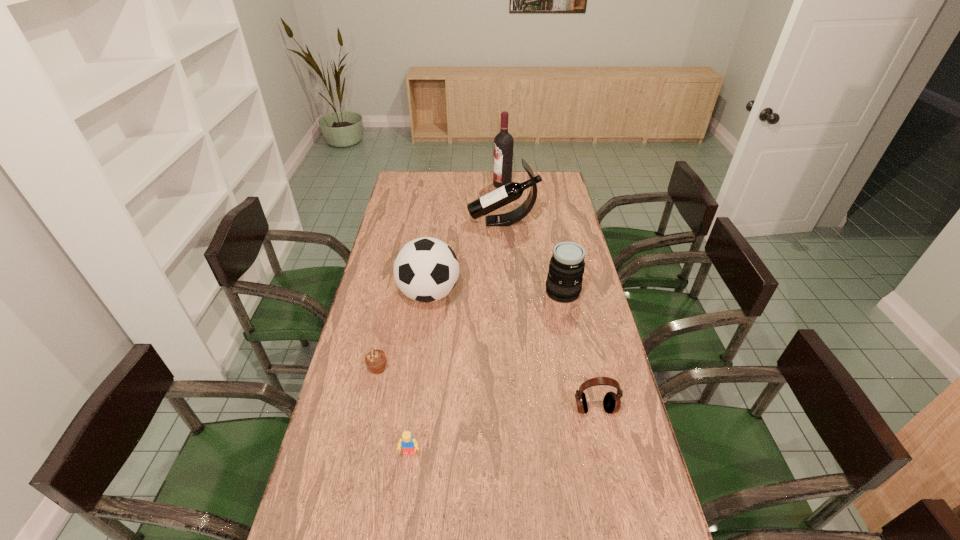
Identify which object is the nearest to the sixth nearest object. Please provide its 2D coordinates. Your answer should be formatted as a tuple, i.e. [(x, y)], where the tuple contains the x and y coordinates of a point satisfying the conditions above.

[(503, 143)]

This screenshot has height=540, width=960. In order to click on vacant position in the image that satisfies the following two spatial constraints: 1. on the stand of the nearer wine bottle; 2. on the front-facing side of the Lego in this screenshot , I will do `click(518, 453)`.

Identify the location of free space in the image that satisfies the following two spatial constraints: 1. on the back side of the telephoto lens; 2. on the left side of the soccer ball. (429, 292).

Identify the location of vacant space that satisfies the following two spatial constraints: 1. on the stand of the nearer wine bottle; 2. on the front-facing side of the Lego. This screenshot has height=540, width=960. (518, 453).

This screenshot has width=960, height=540. In order to click on vacant point that satisfies the following two spatial constraints: 1. on the back side of the fourth tallest object; 2. on the right side of the fifth farthest object in this screenshot , I will do `click(395, 292)`.

You are a GUI agent. You are given a task and a screenshot of the screen. Output one action in this format:
    pyautogui.click(x=<x>, y=<y>)
    Task: Click on the vacant position in the image that satisfies the following two spatial constraints: 1. on the label of the farthest object; 2. on the front-facing side of the Lego
    
    Given the screenshot: What is the action you would take?
    522,453

What are the coordinates of `vacant region that satisfies the following two spatial constraints: 1. on the stand of the second tallest object; 2. on the front-facing side of the nearest object` in the screenshot? It's located at (518, 453).

Identify the location of vacant space that satisfies the following two spatial constraints: 1. on the stand of the nearer wine bottle; 2. on the back side of the fourth shortest object. (508, 292).

Find the location of `vacant region that satisfies the following two spatial constraints: 1. on the stand of the nearer wine bottle; 2. on the front-facing side of the Lego`. vacant region that satisfies the following two spatial constraints: 1. on the stand of the nearer wine bottle; 2. on the front-facing side of the Lego is located at coordinates (518, 453).